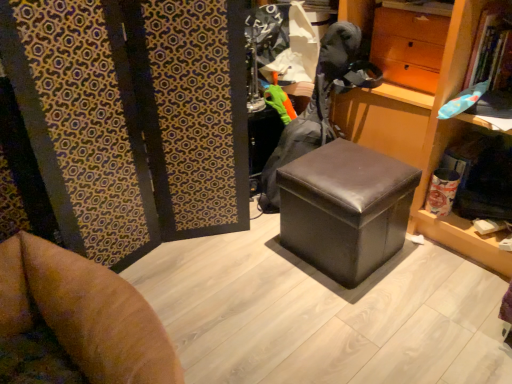
Question: Can you confirm if green fabric glove at center is shorter than matte brown drawer at upper right?

Choices:
 (A) yes
 (B) no

Answer: (B)

Question: Is green fabric glove at center to the left of matte brown drawer at upper right from the viewer's perspective?

Choices:
 (A) no
 (B) yes

Answer: (B)

Question: Are green fabric glove at center and matte brown drawer at upper right making contact?

Choices:
 (A) no
 (B) yes

Answer: (A)

Question: Can you confirm if green fabric glove at center is wider than matte brown drawer at upper right?

Choices:
 (A) no
 (B) yes

Answer: (B)

Question: Considering the relative sizes of green fabric glove at center and matte brown drawer at upper right in the image provided, is green fabric glove at center taller than matte brown drawer at upper right?

Choices:
 (A) no
 (B) yes

Answer: (B)

Question: From the image's perspective, is wooden bookshelf at center located above or below green fabric glove at center?

Choices:
 (A) below
 (B) above

Answer: (B)

Question: Is point (468, 251) positioned closer to the camera than point (261, 185)?

Choices:
 (A) closer
 (B) farther

Answer: (A)

Question: From a real-world perspective, relative to green fabric glove at center, is wooden bookshelf at center vertically above or below?

Choices:
 (A) above
 (B) below

Answer: (A)

Question: Is wooden bookshelf at center inside the boundaries of green fabric glove at center, or outside?

Choices:
 (A) inside
 (B) outside

Answer: (B)

Question: Is green fabric glove at center taller or shorter than black leather ottoman at center?

Choices:
 (A) tall
 (B) short

Answer: (A)

Question: From the image's perspective, is green fabric glove at center above or below black leather ottoman at center?

Choices:
 (A) below
 (B) above

Answer: (B)

Question: From a real-world perspective, is green fabric glove at center above or below black leather ottoman at center?

Choices:
 (A) below
 (B) above

Answer: (B)

Question: Considering the positions of point (322, 102) and point (321, 195), is point (322, 102) closer or farther from the camera than point (321, 195)?

Choices:
 (A) closer
 (B) farther

Answer: (B)

Question: Considering the positions of black leather ottoman at center and matte brown drawer at upper right in the image, is black leather ottoman at center wider or thinner than matte brown drawer at upper right?

Choices:
 (A) wide
 (B) thin

Answer: (A)

Question: Considering the positions of black leather ottoman at center and matte brown drawer at upper right in the image, is black leather ottoman at center bigger or smaller than matte brown drawer at upper right?

Choices:
 (A) big
 (B) small

Answer: (A)